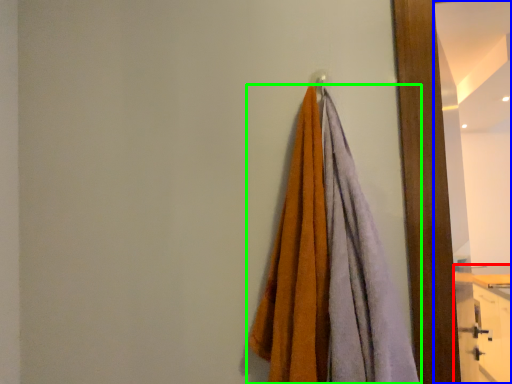
Question: Which object is positioned closest to dresser (highlighted by a red box)? Select from mirror (highlighted by a blue box) and towel (highlighted by a green box).

Choices:
 (A) mirror
 (B) towel

Answer: (A)